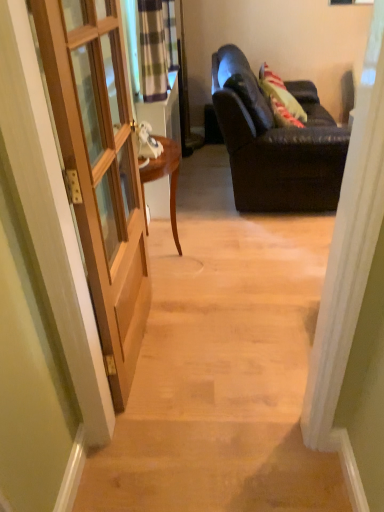
This screenshot has width=384, height=512. In order to click on vacant area that is situated to the right of wooden door at left in this screenshot , I will do `click(216, 340)`.